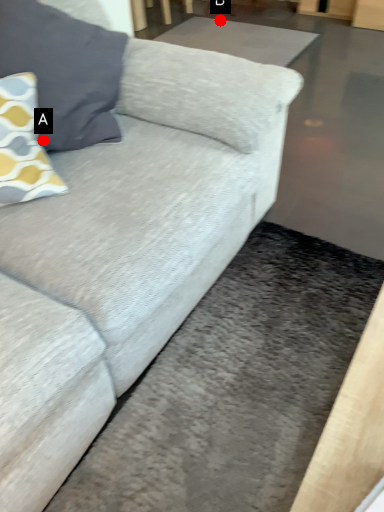
Question: Two points are circled on the image, labeled by A and B beside each circle. Which point is closer to the camera taking this photo?

Choices:
 (A) A is closer
 (B) B is closer

Answer: (A)